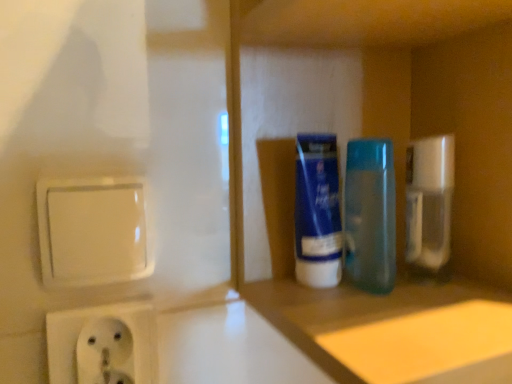
Question: From a real-world perspective, is clear plastic spray bottle at right over blue translucent bottle at center, the second mouthwash positioned from the left?

Choices:
 (A) no
 (B) yes

Answer: (B)

Question: Considering the relative sizes of clear plastic spray bottle at right and blue translucent bottle at center, the second mouthwash positioned from the left, in the image provided, is clear plastic spray bottle at right shorter than blue translucent bottle at center, the second mouthwash positioned from the left,?

Choices:
 (A) yes
 (B) no

Answer: (A)

Question: Can we say clear plastic spray bottle at right lies outside blue translucent bottle at center, the 1th mouthwash positioned from the right?

Choices:
 (A) yes
 (B) no

Answer: (A)

Question: Considering the relative sizes of clear plastic spray bottle at right and blue translucent bottle at center, the 1th mouthwash positioned from the right, in the image provided, is clear plastic spray bottle at right thinner than blue translucent bottle at center, the 1th mouthwash positioned from the right,?

Choices:
 (A) no
 (B) yes

Answer: (B)

Question: Is clear plastic spray bottle at right facing away from blue translucent bottle at center, the second mouthwash positioned from the left?

Choices:
 (A) no
 (B) yes

Answer: (A)

Question: Is point (287, 13) closer or farther from the camera than point (377, 248)?

Choices:
 (A) closer
 (B) farther

Answer: (A)

Question: Considering the positions of blue plastic bottles at center and blue translucent bottle at center, the second mouthwash positioned from the left, in the image, is blue plastic bottles at center taller or shorter than blue translucent bottle at center, the second mouthwash positioned from the left,?

Choices:
 (A) tall
 (B) short

Answer: (A)

Question: In terms of size, does blue plastic bottles at center appear bigger or smaller than blue translucent bottle at center, the second mouthwash positioned from the left?

Choices:
 (A) small
 (B) big

Answer: (B)

Question: Is blue plastic bottles at center inside the boundaries of blue translucent bottle at center, the 1th mouthwash positioned from the right, or outside?

Choices:
 (A) outside
 (B) inside

Answer: (A)

Question: Visually, is clear plastic spray bottle at right positioned to the left or to the right of blue glossy tube at center, which appears as the 1th mouthwash when viewed from the left?

Choices:
 (A) left
 (B) right

Answer: (B)

Question: Would you say clear plastic spray bottle at right is inside or outside blue glossy tube at center, which is the 2th mouthwash in right-to-left order?

Choices:
 (A) outside
 (B) inside

Answer: (A)

Question: From a real-world perspective, is clear plastic spray bottle at right positioned above or below blue glossy tube at center, which appears as the 1th mouthwash when viewed from the left?

Choices:
 (A) above
 (B) below

Answer: (A)

Question: From the image's perspective, is clear plastic spray bottle at right located above or below blue glossy tube at center, which appears as the 1th mouthwash when viewed from the left?

Choices:
 (A) above
 (B) below

Answer: (A)

Question: Visually, is clear plastic spray bottle at right positioned to the left or to the right of blue plastic bottles at center?

Choices:
 (A) left
 (B) right

Answer: (B)

Question: From a real-world perspective, is clear plastic spray bottle at right positioned above or below blue plastic bottles at center?

Choices:
 (A) above
 (B) below

Answer: (B)